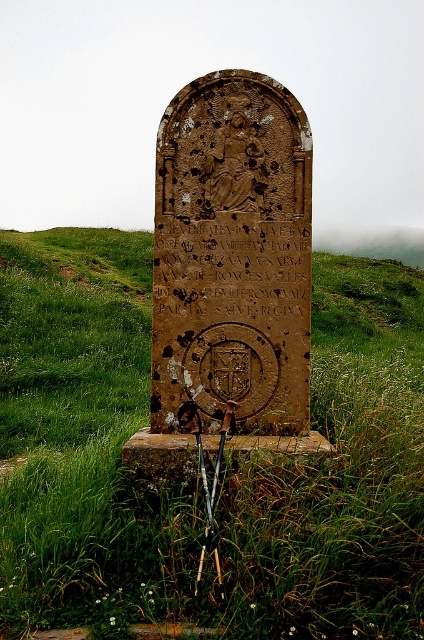
You are standing in front of the monument and want to place a 10 feet long decorative banner between yourself and the green grassy at center. Can the banner fit without overlapping the monument?

The distance between you and the green grassy at center is 11.02 feet, so a 10 feet long banner can fit without overlapping the monument.